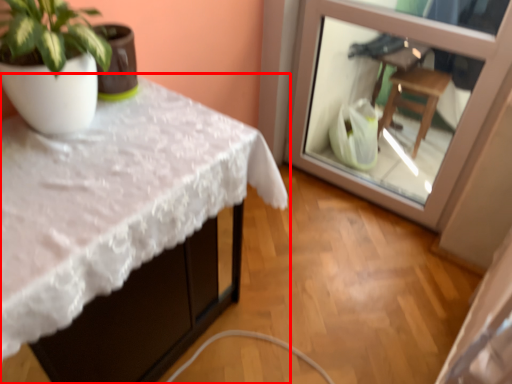
Question: Observing the image, what is the correct spatial positioning of table (annotated by the red box) in reference to glass door?

Choices:
 (A) left
 (B) right

Answer: (A)